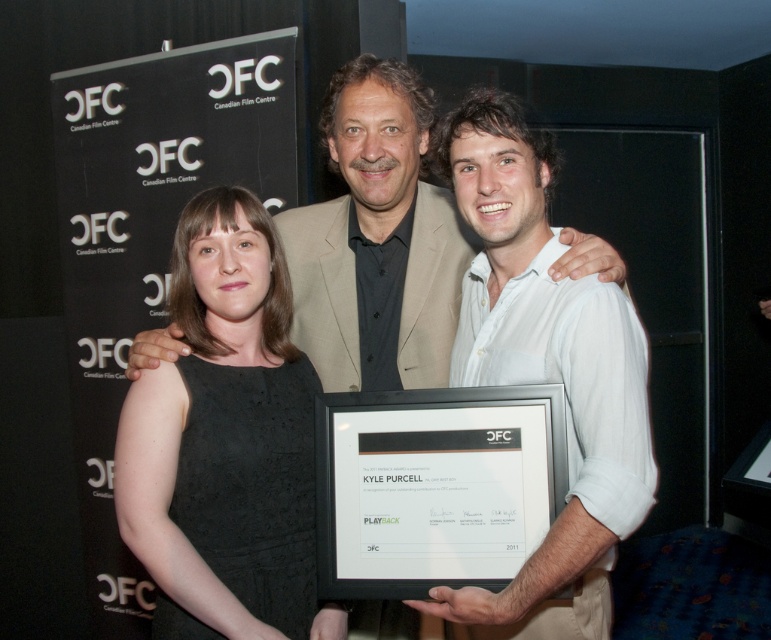
Question: Among these points, which one is farthest from the camera?

Choices:
 (A) (231, 630)
 (B) (423, 112)
 (C) (482, 301)
 (D) (369, 490)

Answer: (B)

Question: Can you confirm if light beige suit at center is smaller than white paper at center?

Choices:
 (A) no
 (B) yes

Answer: (A)

Question: Which object is positioned farthest from the black textured dress at left?

Choices:
 (A) white paper at center
 (B) light beige suit at center

Answer: (B)

Question: Is black textured dress at left wider than white shirt at center?

Choices:
 (A) yes
 (B) no

Answer: (B)

Question: Does white shirt at center appear over white paper at center?

Choices:
 (A) yes
 (B) no

Answer: (A)

Question: Which point is closer to the camera taking this photo?

Choices:
 (A) (460, 285)
 (B) (483, 148)
 (C) (261, 236)

Answer: (B)